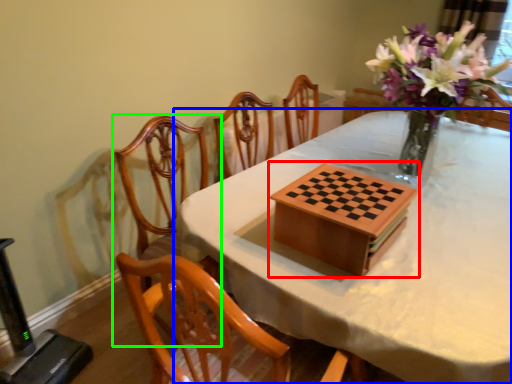
Question: Estimate the real-world distances between objects in this image. Which object is farther from board game (highlighted by a red box), table (highlighted by a blue box) or chair (highlighted by a green box)?

Choices:
 (A) table
 (B) chair

Answer: (B)